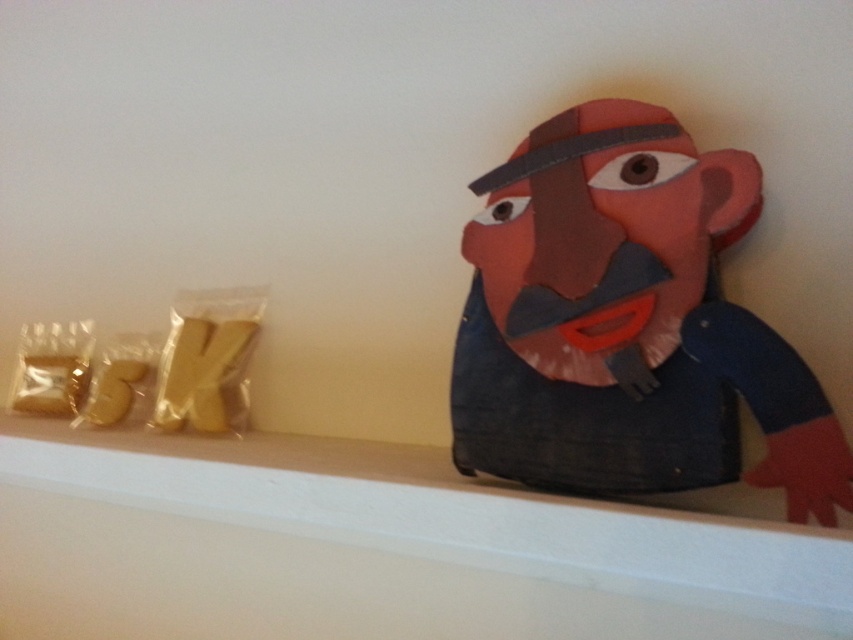
You are standing in front of the shelf and want to place a small decorative item between the two points, point (722, 384) and point (698, 616). Which point should you place it closer to so that it appears in front of the other point from your current viewpoint?

You should place the item closer to point (722, 384) because it is in front of point (698, 616) from your current viewpoint.